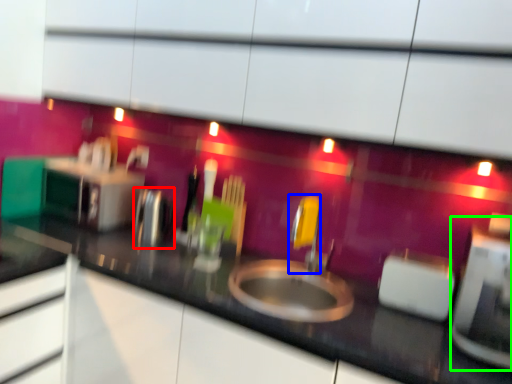
Question: Which object is positioned closest to appliance (highlighted by a red box)? Select from faucet (highlighted by a blue box) and appliance (highlighted by a green box).

Choices:
 (A) faucet
 (B) appliance

Answer: (A)